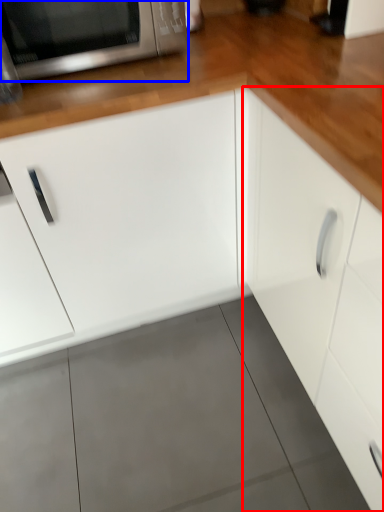
Question: Among these objects, which one is farthest to the camera, cabinetry (highlighted by a red box) or microwave oven (highlighted by a blue box)?

Choices:
 (A) cabinetry
 (B) microwave oven

Answer: (B)